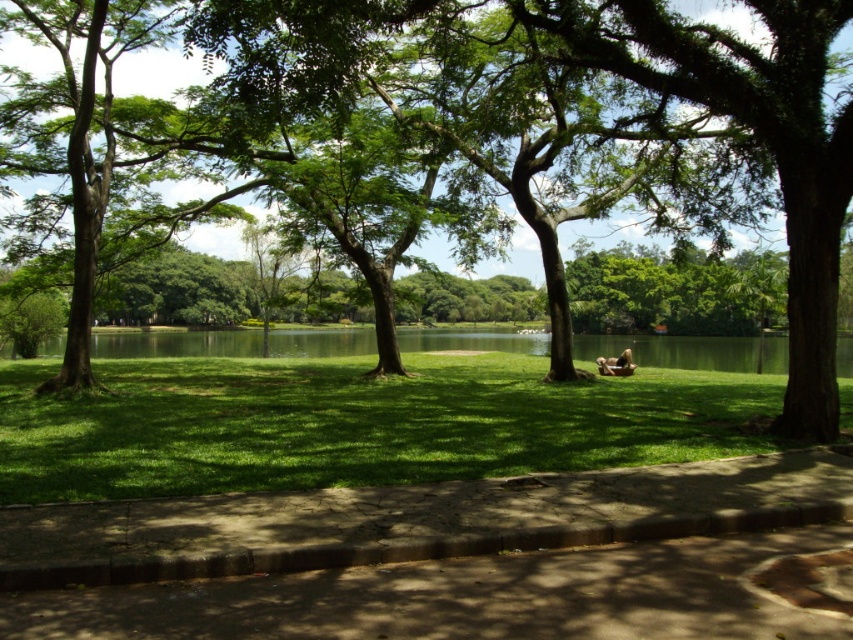
Who is more distant from viewer, (717, 365) or (630, 353)?

The point (717, 365) is behind.

Locate an element on the screen. Image resolution: width=853 pixels, height=640 pixels. green liquid water at center is located at coordinates (674, 349).

The width and height of the screenshot is (853, 640). Find the location of `green liquid water at center`. green liquid water at center is located at coordinates (674, 349).

Does green grass at center have a smaller size compared to brown leather bag at center?

Indeed, green grass at center has a smaller size compared to brown leather bag at center.

Is point (123, 404) less distant than point (630, 362)?

Yes, it is in front of point (630, 362).

What are the coordinates of `green grass at center` in the screenshot? It's located at (357, 424).

Can you confirm if green grass at center is taller than green liquid water at center?

No, green grass at center is not taller than green liquid water at center.

Where is `green grass at center`? The image size is (853, 640). green grass at center is located at coordinates (357, 424).

Is point (173, 413) farther from camera compared to point (779, 372)?

No, it is not.

The image size is (853, 640). What are the coordinates of `green grass at center` in the screenshot? It's located at (357, 424).